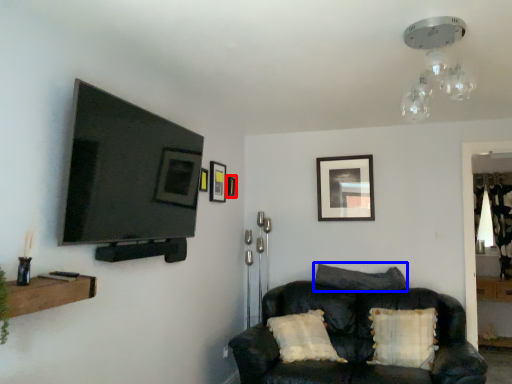
Question: Which object appears farthest to the camera in this image, picture frame (highlighted by a red box) or pillow (highlighted by a blue box)?

Choices:
 (A) picture frame
 (B) pillow

Answer: (A)